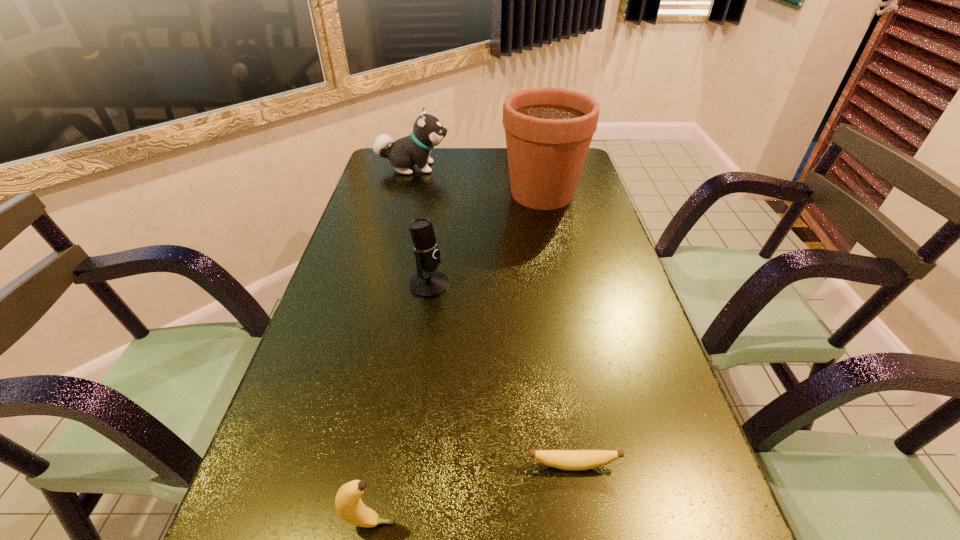
What are the coordinates of `free space between the microphone and the fourth tallest object` in the screenshot? It's located at (399, 404).

The width and height of the screenshot is (960, 540). Find the location of `free point between the taller banana and the tallest object`. free point between the taller banana and the tallest object is located at coordinates (456, 359).

Identify which object is the second closest to the puppy. Please provide its 2D coordinates. Your answer should be formatted as a tuple, i.e. [(x, y)], where the tuple contains the x and y coordinates of a point satisfying the conditions above.

[(428, 282)]

At what (x,y) coordinates should I click in order to perform the action: click on object that is the fourth nearest to the puppy. Please return your answer as a coordinate pair (x, y). Image resolution: width=960 pixels, height=540 pixels. Looking at the image, I should click on (349, 505).

Where is `vacant area in the image that satisfies the following two spatial constraints: 1. on the back side of the shortest object; 2. at the face of the puppy`? The image size is (960, 540). vacant area in the image that satisfies the following two spatial constraints: 1. on the back side of the shortest object; 2. at the face of the puppy is located at coordinates (525, 167).

Locate an element on the screen. This screenshot has height=540, width=960. free space that satisfies the following two spatial constraints: 1. at the face of the flowerpot; 2. on the left side of the puppy is located at coordinates (406, 193).

At what (x,y) coordinates should I click in order to perform the action: click on vacant point that satisfies the following two spatial constraints: 1. at the face of the puppy; 2. on the left side of the third nearest object. Please return your answer as a coordinate pair (x, y). Looking at the image, I should click on (384, 285).

The height and width of the screenshot is (540, 960). I want to click on vacant position in the image that satisfies the following two spatial constraints: 1. on the front side of the third farthest object; 2. from the stem of the nearest object, so click(398, 523).

Locate an element on the screen. The width and height of the screenshot is (960, 540). vacant space that satisfies the following two spatial constraints: 1. at the face of the puppy; 2. on the left side of the microphone is located at coordinates (384, 285).

Locate an element on the screen. The width and height of the screenshot is (960, 540). vacant space that satisfies the following two spatial constraints: 1. at the face of the puppy; 2. on the left side of the flowerpot is located at coordinates (406, 193).